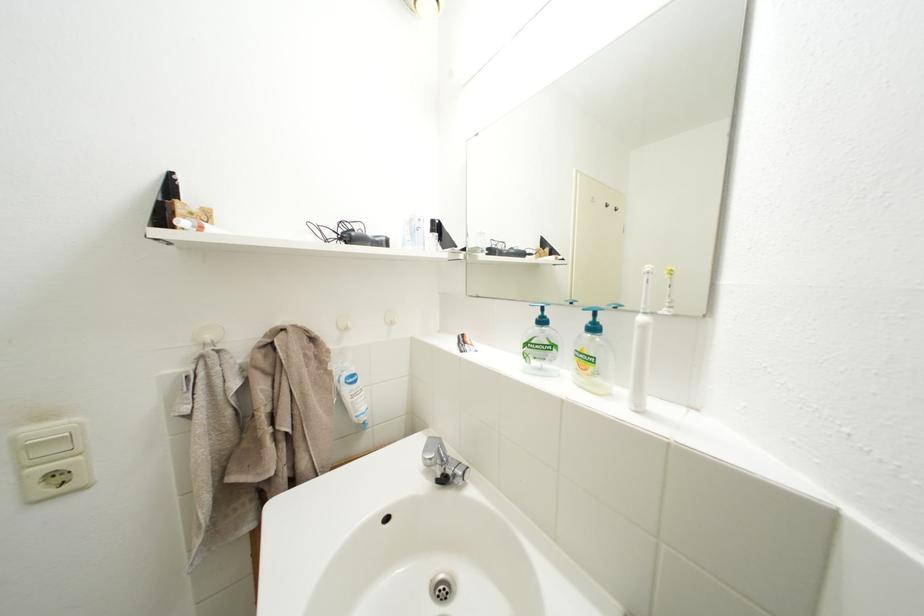
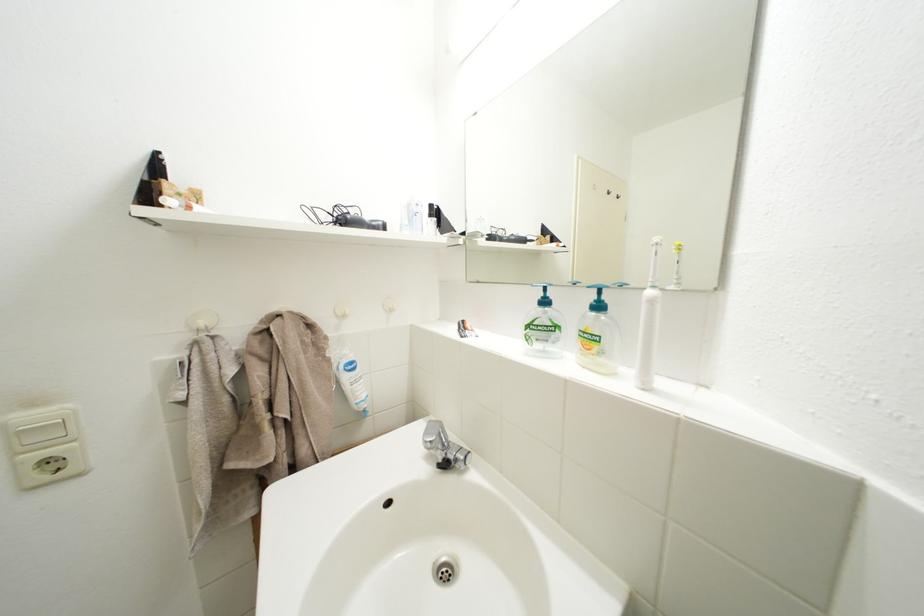
Question: In a continuous first-person perspective shot, in which direction is the camera moving?

Choices:
 (A) Left
 (B) Right
 (C) Forward
 (D) Backward

Answer: (C)